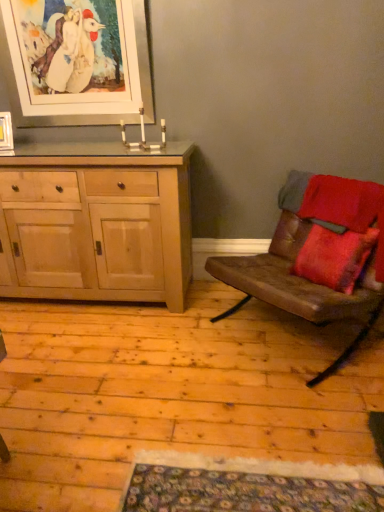
Find the location of `brown leather couch at right`. brown leather couch at right is located at coordinates (316, 251).

The height and width of the screenshot is (512, 384). I want to click on matte wooden picture frame at upper left, positioned as the first picture frame in bottom-to-top order, so click(6, 132).

I want to click on white matte picture frame at upper left, which ranks as the 1th picture frame in top-to-bottom order, so click(48, 115).

Considering the positions of points (236, 279) and (83, 179), is point (236, 279) farther from camera compared to point (83, 179)?

No, (236, 279) is closer to viewer.

Could you tell me if brown leather couch at right is facing natural wood cabinet at left?

No, brown leather couch at right is not facing towards natural wood cabinet at left.

From a real-world perspective, which is physically above, brown leather couch at right or natural wood cabinet at left?

natural wood cabinet at left is physically above.

Are brown leather couch at right and natural wood cabinet at left beside each other?

No.

Which is closer, (269, 275) or (8, 128)?

Point (269, 275) appears to be closer to the viewer than point (8, 128).

Identify the location of chair in front of the matte wooden picture frame at upper left, the 2th picture frame positioned from the right. (316, 251).

Can you tell me how much brown leather couch at right and matte wooden picture frame at upper left, the 2th picture frame positioned from the right, differ in facing direction?

brown leather couch at right and matte wooden picture frame at upper left, the 2th picture frame positioned from the right, are facing 57.9 degrees away from each other.

Is brown leather couch at right facing towards matte wooden picture frame at upper left, acting as the 1th picture frame starting from the left?

No, brown leather couch at right is not facing towards matte wooden picture frame at upper left, acting as the 1th picture frame starting from the left.

Looking at this image, is natural wood cabinet at left positioned with its back to white matte picture frame at upper left, which ranks as the 1th picture frame in top-to-bottom order?

No.

Who is more distant, natural wood cabinet at left or white matte picture frame at upper left, which ranks as the 1th picture frame in top-to-bottom order?

white matte picture frame at upper left, which ranks as the 1th picture frame in top-to-bottom order, is further from the camera.

Can you confirm if natural wood cabinet at left is taller than white matte picture frame at upper left, which ranks as the 1th picture frame in top-to-bottom order?

Yes, natural wood cabinet at left is taller than white matte picture frame at upper left, which ranks as the 1th picture frame in top-to-bottom order.

Which picture frame is the 1st one when counting from the back of the natural wood cabinet at left? Please provide its 2D coordinates.

[(48, 115)]

Looking at the image, does matte wooden picture frame at upper left, acting as the 1th picture frame starting from the left, seem bigger or smaller compared to natural wood cabinet at left?

Clearly, matte wooden picture frame at upper left, acting as the 1th picture frame starting from the left, is smaller in size than natural wood cabinet at left.

How many degrees apart are the facing directions of matte wooden picture frame at upper left, acting as the 1th picture frame starting from the left, and natural wood cabinet at left?

14.5 degrees separate the facing orientations of matte wooden picture frame at upper left, acting as the 1th picture frame starting from the left, and natural wood cabinet at left.

In the image, is matte wooden picture frame at upper left, the 2th picture frame positioned from the right, positioned in front of or behind natural wood cabinet at left?

Visually, matte wooden picture frame at upper left, the 2th picture frame positioned from the right, is located behind natural wood cabinet at left.

Which object is positioned more to the left, matte wooden picture frame at upper left, the 2th picture frame positioned from the right, or natural wood cabinet at left?

matte wooden picture frame at upper left, the 2th picture frame positioned from the right.

Where is `chair in front of the white matte picture frame at upper left, which appears as the 1th picture frame when viewed from the right`? The width and height of the screenshot is (384, 512). chair in front of the white matte picture frame at upper left, which appears as the 1th picture frame when viewed from the right is located at coordinates (316, 251).

Which object is wider, brown leather couch at right or white matte picture frame at upper left, positioned as the second picture frame in bottom-to-top order?

Wider between the two is brown leather couch at right.

From the image's perspective, between brown leather couch at right and white matte picture frame at upper left, which appears as the 1th picture frame when viewed from the right, which one is located above?

white matte picture frame at upper left, which appears as the 1th picture frame when viewed from the right, is shown above in the image.

From a real-world perspective, who is located lower, brown leather couch at right or white matte picture frame at upper left, which ranks as the 1th picture frame in top-to-bottom order?

brown leather couch at right is physically lower.

Considering the sizes of objects white matte picture frame at upper left, which ranks as the 1th picture frame in top-to-bottom order, and matte wooden picture frame at upper left, acting as the 1th picture frame starting from the left, in the image provided, who is smaller, white matte picture frame at upper left, which ranks as the 1th picture frame in top-to-bottom order, or matte wooden picture frame at upper left, acting as the 1th picture frame starting from the left,?

With smaller size is matte wooden picture frame at upper left, acting as the 1th picture frame starting from the left.

Image resolution: width=384 pixels, height=512 pixels. In order to click on picture frame that appears on the right of matte wooden picture frame at upper left, acting as the 1th picture frame starting from the left in this screenshot , I will do click(48, 115).

Could you tell me if white matte picture frame at upper left, positioned as the second picture frame in bottom-to-top order, is turned towards matte wooden picture frame at upper left, positioned as the 2th picture frame in top-to-bottom order?

Yes, white matte picture frame at upper left, positioned as the second picture frame in bottom-to-top order, is aimed at matte wooden picture frame at upper left, positioned as the 2th picture frame in top-to-bottom order.

Is white matte picture frame at upper left, which ranks as the 1th picture frame in top-to-bottom order, with matte wooden picture frame at upper left, positioned as the 2th picture frame in top-to-bottom order?

No.

Is white matte picture frame at upper left, positioned as the second picture frame in bottom-to-top order, further to the viewer compared to natural wood cabinet at left?

Yes, it is.

You are a GUI agent. You are given a task and a screenshot of the screen. Output one action in this format:
    pyautogui.click(x=<x>, y=<y>)
    Task: Click on the cabinetry in front of the white matte picture frame at upper left, marked as the second picture frame in a left-to-right arrangement
    
    Given the screenshot: What is the action you would take?
    pyautogui.click(x=96, y=223)

From the image's perspective, relative to natural wood cabinet at left, is white matte picture frame at upper left, marked as the second picture frame in a left-to-right arrangement, above or below?

white matte picture frame at upper left, marked as the second picture frame in a left-to-right arrangement, is above natural wood cabinet at left.

Could you measure the distance between white matte picture frame at upper left, which ranks as the 1th picture frame in top-to-bottom order, and natural wood cabinet at left?

A distance of 74.25 centimeters exists between white matte picture frame at upper left, which ranks as the 1th picture frame in top-to-bottom order, and natural wood cabinet at left.

The width and height of the screenshot is (384, 512). I want to click on cabinetry located behind the brown leather couch at right, so click(x=96, y=223).

The image size is (384, 512). Find the location of `chair below the matte wooden picture frame at upper left, acting as the 1th picture frame starting from the left (from the image's perspective)`. chair below the matte wooden picture frame at upper left, acting as the 1th picture frame starting from the left (from the image's perspective) is located at coordinates tap(316, 251).

Which object lies further to the anchor point natural wood cabinet at left, white matte picture frame at upper left, marked as the second picture frame in a left-to-right arrangement, or brown leather couch at right?

The object further to natural wood cabinet at left is brown leather couch at right.

Based on their spatial positions, is brown leather couch at right or natural wood cabinet at left closer to matte wooden picture frame at upper left, the 2th picture frame positioned from the right?

natural wood cabinet at left.

Considering their positions, is brown leather couch at right positioned further to white matte picture frame at upper left, which appears as the 1th picture frame when viewed from the right, than matte wooden picture frame at upper left, acting as the 1th picture frame starting from the left?

The object further to white matte picture frame at upper left, which appears as the 1th picture frame when viewed from the right, is brown leather couch at right.

Based on their spatial positions, is matte wooden picture frame at upper left, the 2th picture frame positioned from the right, or brown leather couch at right closer to white matte picture frame at upper left, which ranks as the 1th picture frame in top-to-bottom order?

Among the two, matte wooden picture frame at upper left, the 2th picture frame positioned from the right, is located nearer to white matte picture frame at upper left, which ranks as the 1th picture frame in top-to-bottom order.

When comparing their distances from brown leather couch at right, does white matte picture frame at upper left, marked as the second picture frame in a left-to-right arrangement, or natural wood cabinet at left seem closer?

natural wood cabinet at left is positioned closer to the anchor brown leather couch at right.

Based on the photo, based on their spatial positions, is brown leather couch at right or natural wood cabinet at left further from white matte picture frame at upper left, marked as the second picture frame in a left-to-right arrangement?

brown leather couch at right.

When comparing their distances from white matte picture frame at upper left, marked as the second picture frame in a left-to-right arrangement, does natural wood cabinet at left or brown leather couch at right seem further?

The object further to white matte picture frame at upper left, marked as the second picture frame in a left-to-right arrangement, is brown leather couch at right.

From the image, which object appears to be nearer to natural wood cabinet at left, brown leather couch at right or white matte picture frame at upper left, which appears as the 1th picture frame when viewed from the right?

The object closer to natural wood cabinet at left is white matte picture frame at upper left, which appears as the 1th picture frame when viewed from the right.

You are a GUI agent. You are given a task and a screenshot of the screen. Output one action in this format:
    pyautogui.click(x=<x>, y=<y>)
    Task: Click on the picture frame between white matte picture frame at upper left, which ranks as the 1th picture frame in top-to-bottom order, and natural wood cabinet at left from top to bottom
    
    Given the screenshot: What is the action you would take?
    pyautogui.click(x=6, y=132)

At what (x,y) coordinates should I click in order to perform the action: click on picture frame between matte wooden picture frame at upper left, positioned as the 2th picture frame in top-to-bottom order, and brown leather couch at right from left to right. Please return your answer as a coordinate pair (x, y). This screenshot has height=512, width=384. Looking at the image, I should click on (48, 115).

Find the location of a particular element. The image size is (384, 512). picture frame between natural wood cabinet at left and brown leather couch at right in the horizontal direction is located at coordinates (48, 115).

At what (x,y) coordinates should I click in order to perform the action: click on cabinetry situated between matte wooden picture frame at upper left, positioned as the first picture frame in bottom-to-top order, and brown leather couch at right from left to right. Please return your answer as a coordinate pair (x, y). The image size is (384, 512). Looking at the image, I should click on tap(96, 223).